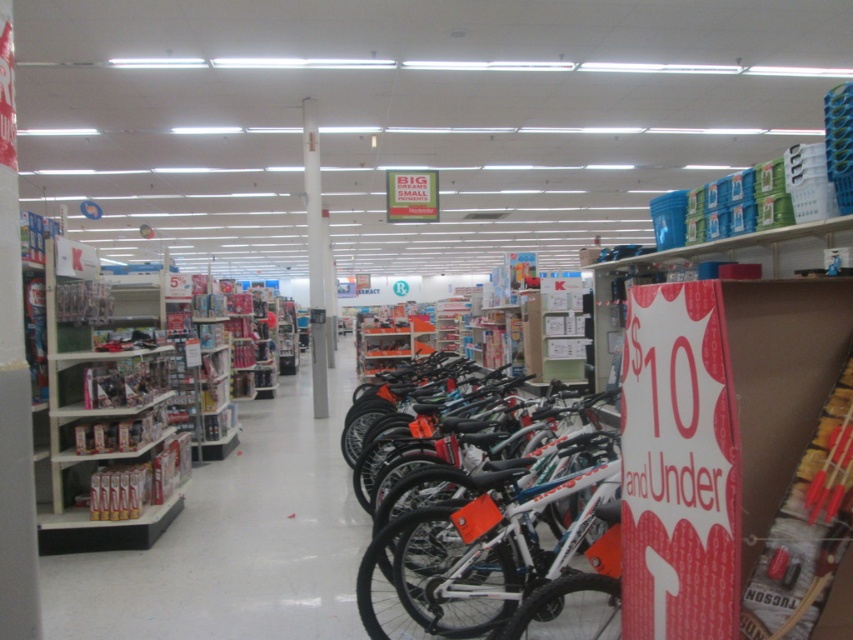
You are a customer in the store looking at the white matte bicycle at center and the white glossy pillar at center. Which object is positioned lower in the image?

The white matte bicycle at center is positioned below the white glossy pillar at center, so it is lower in the image.

You are a customer in the store and want to see the bicycles on the right. Is the white smooth pillar at center blocking your view of the bicycles on the right?

The white smooth pillar at center is 2.08 meters from the camera, so it is possible that the pillar is not blocking the view of the bicycles on the right, depending on the camera angle and the arrangement of the bicycles. However, without more information about the camera position and the layout of the store, it is difficult to determine if the pillar is obstructing the view.

You are a customer entering the store and want to walk through the aisle between the white smooth pillar at center and the white glossy pillar at center. Can you pass through comfortably?

The white smooth pillar at center occupies less space than the white glossy pillar at center, so there might be limited space between them. It is uncertain if you can pass through comfortably without more information about the exact distance between them.